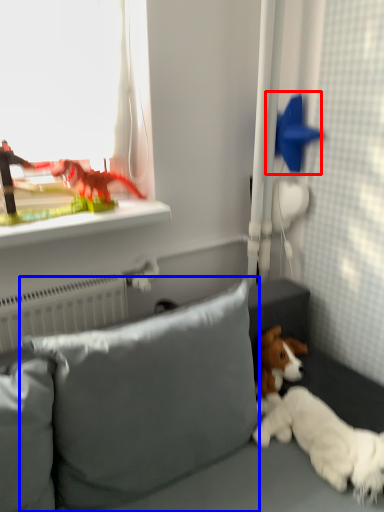
Question: Which object appears farthest to the camera in this image, toy (highlighted by a red box) or pillow (highlighted by a blue box)?

Choices:
 (A) toy
 (B) pillow

Answer: (A)